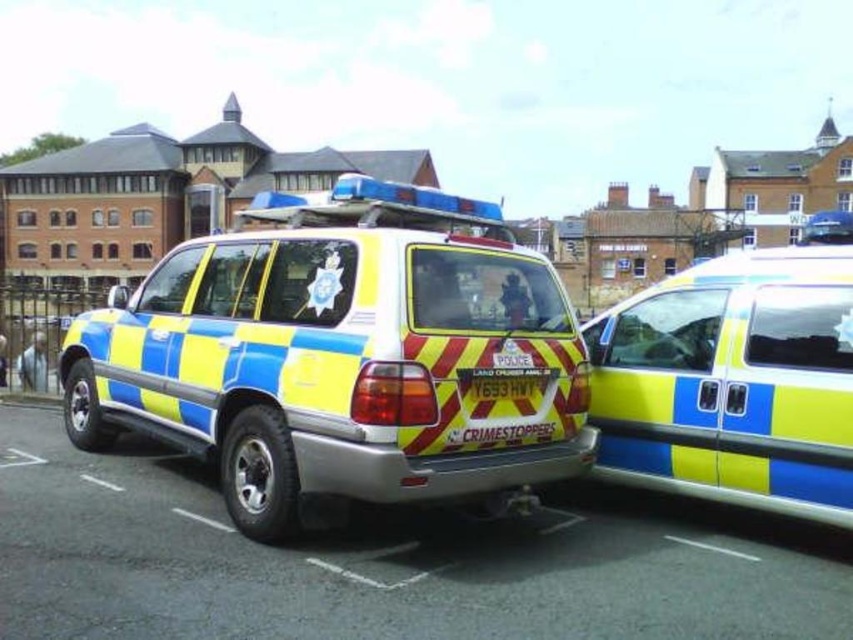
Question: Can you confirm if blue and yellow striped police vehicle at center is bigger than yellow and blue striped police vehicle at right?

Choices:
 (A) no
 (B) yes

Answer: (A)

Question: Does blue and yellow striped police vehicle at center have a larger size compared to yellow and blue striped police vehicle at right?

Choices:
 (A) no
 (B) yes

Answer: (A)

Question: Which point appears farthest from the camera in this image?

Choices:
 (A) (776, 467)
 (B) (341, 272)

Answer: (A)

Question: Does blue and yellow striped police vehicle at center appear over yellow and blue striped police vehicle at right?

Choices:
 (A) yes
 (B) no

Answer: (A)

Question: Which point is farther to the camera?

Choices:
 (A) yellow and blue striped police vehicle at right
 (B) blue and yellow striped police vehicle at center

Answer: (A)